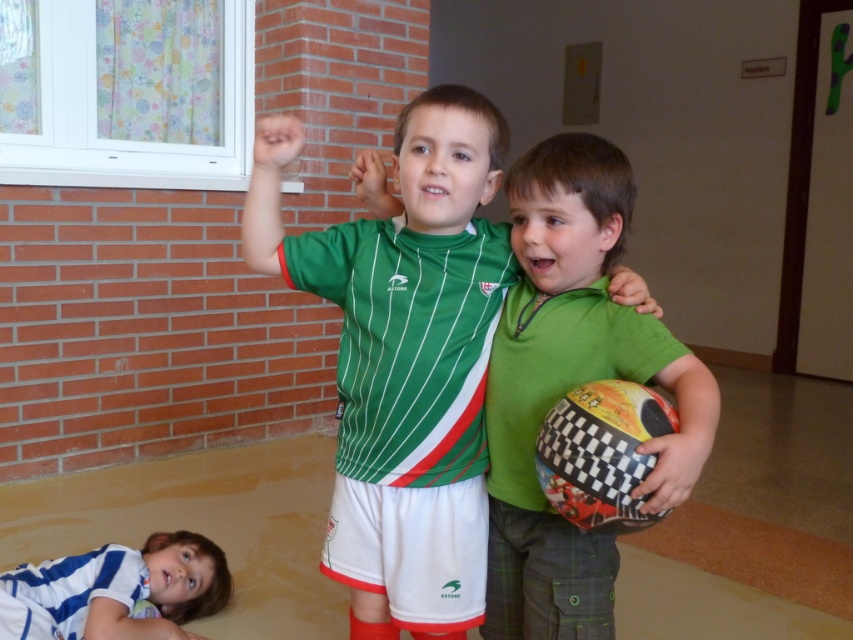
You are standing at the point marked as point (x=460, y=538) in the image. You want to walk to the nearest exit, which is located 5 feet away from your current position. Can you reach the exit without moving more than 5 feet?

The distance between point (x=460, y=538) and the viewer is 4.59 feet. Since the exit is 5 feet away, you can reach it without moving more than 5 feet.